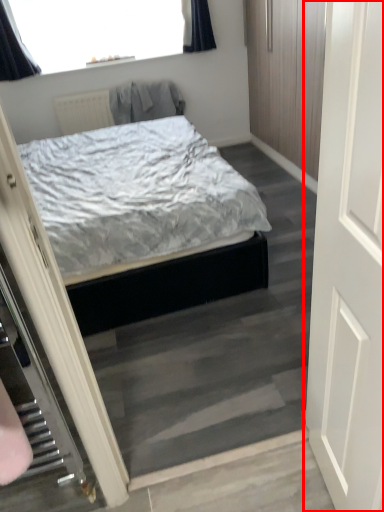
Question: From the image's perspective, considering the relative positions of door (annotated by the red box) and robe in the image provided, where is door (annotated by the red box) located with respect to the staircase?

Choices:
 (A) above
 (B) below

Answer: (B)